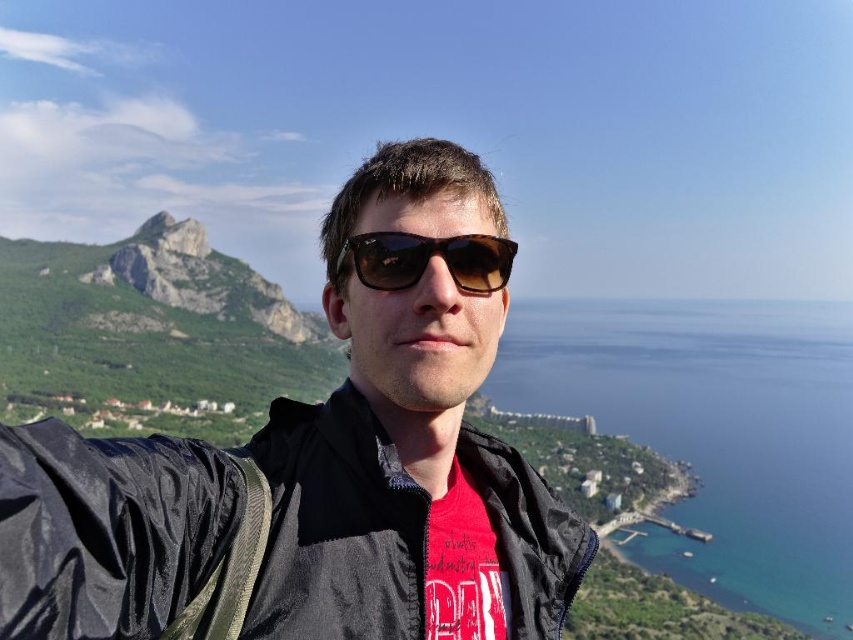
Question: Is black matte jacket at center positioned before green rocky mountain at left?

Choices:
 (A) no
 (B) yes

Answer: (B)

Question: Among these objects, which one is nearest to the camera?

Choices:
 (A) tortoiseshell sunglasses at center
 (B) black matte jacket at center

Answer: (B)

Question: Where is green rocky mountain at left located in relation to tortoiseshell sunglasses at center in the image?

Choices:
 (A) below
 (B) above

Answer: (A)

Question: Which object is the closest to the tortoiseshell sunglasses at center?

Choices:
 (A) green rocky mountain at left
 (B) black matte jacket at center

Answer: (B)

Question: Which of the following is the closest to the observer?

Choices:
 (A) (189, 268)
 (B) (408, 276)
 (C) (288, 436)

Answer: (C)

Question: Is black matte jacket at center below tortoiseshell sunglasses at center?

Choices:
 (A) no
 (B) yes

Answer: (B)